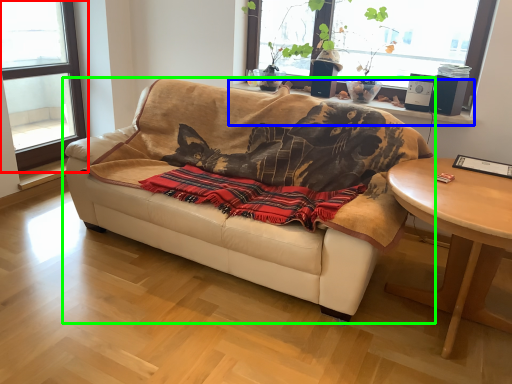
Question: Considering the real-world distances, which object is farthest from window (highlighted by a red box)? window sill (highlighted by a blue box) or studio couch (highlighted by a green box)?

Choices:
 (A) window sill
 (B) studio couch

Answer: (A)